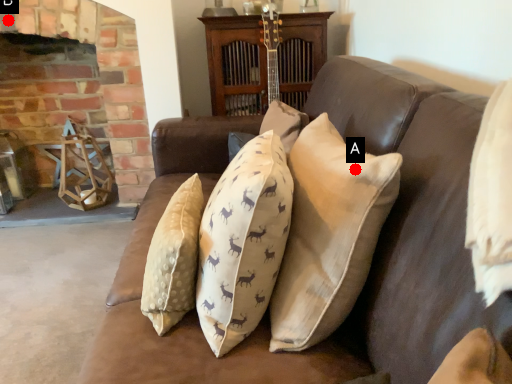
Question: Two points are circled on the image, labeled by A and B beside each circle. Which point is closer to the camera taking this photo?

Choices:
 (A) A is closer
 (B) B is closer

Answer: (A)